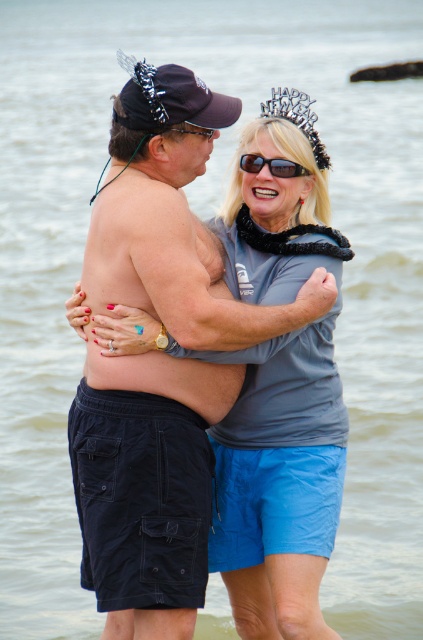
Question: Among these points, which one is nearest to the camera?

Choices:
 (A) (285, 176)
 (B) (209, 131)

Answer: (B)

Question: Can you confirm if sunglasses at center is wider than matte black goggles at center?

Choices:
 (A) yes
 (B) no

Answer: (A)

Question: From the image, what is the correct spatial relationship of sunglasses at center in relation to matte black goggles at center?

Choices:
 (A) below
 (B) above

Answer: (A)

Question: Which of the following is the farthest from the observer?

Choices:
 (A) matte black goggles at center
 (B) sunglasses at center

Answer: (B)

Question: Is sunglasses at center bigger than matte black goggles at center?

Choices:
 (A) no
 (B) yes

Answer: (B)